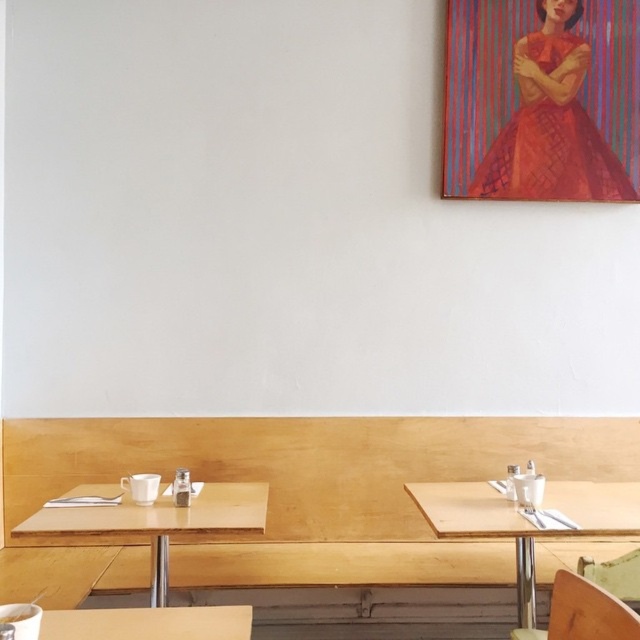
You are a guest at a dinner party and want to place a red woven fabric dress at upper right on the wooden table at right. Can you estimate if the dress will reach the table without needing to move closer?

The red woven fabric dress at upper right is 4.78 feet away from the wooden table at right. Since the distance is about 4.78 feet, you would need to move closer to place the dress on the table unless you can stretch or throw it.

You are standing at the camera position and want to reach the red woven fabric dress at upper right. The dress is on a hanger in a closet that is 3 meters away from the camera. Can you comfortably walk to the dress without needing to move any furniture?

The distance between the red woven fabric dress at upper right and the camera is 3.11 meters, which is slightly further than the 3 meters mentioned. Therefore, you can comfortably walk to the dress without needing to move any furniture as the extra 0.11 meters is negligible.

You are a guest at a modern dining event and notice the red woven fabric dress at upper right and the wooden chair at lower right. If you want to place the dress on the chair, will it fit? Please consider their distance.

The red woven fabric dress at upper right is 6.99 feet away from the wooden chair at lower right. Since the distance is over 6 feet, the dress cannot be placed on the chair from that distance unless moved closer.